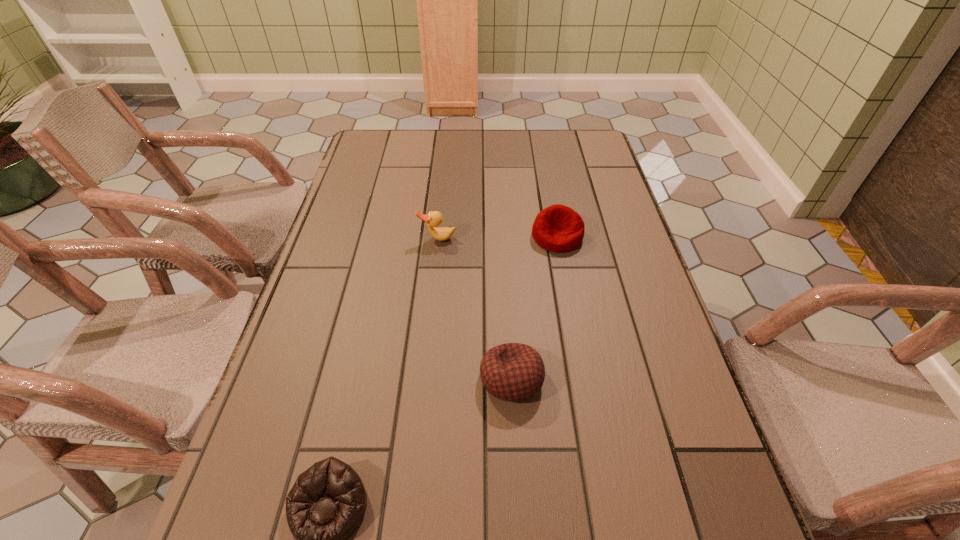
What are the coordinates of `the second object from left to right` in the screenshot? It's located at (435, 218).

Image resolution: width=960 pixels, height=540 pixels. Identify the location of the farthest beanbag. (558, 228).

The width and height of the screenshot is (960, 540). Find the location of `the rightmost object`. the rightmost object is located at coordinates (558, 228).

You are a GUI agent. You are given a task and a screenshot of the screen. Output one action in this format:
    pyautogui.click(x=<x>, y=<y>)
    Task: Click on the second nearest beanbag
    
    Given the screenshot: What is the action you would take?
    pyautogui.click(x=513, y=372)

The image size is (960, 540). In order to click on the second beanbag from left to right in this screenshot , I will do `click(513, 372)`.

Where is `vacant region located 0.180m on the beak of the duck`? This screenshot has height=540, width=960. vacant region located 0.180m on the beak of the duck is located at coordinates (431, 296).

The height and width of the screenshot is (540, 960). What are the coordinates of `free space located 0.230m on the seat area of the rightmost object` in the screenshot? It's located at (574, 327).

The image size is (960, 540). I want to click on free spot located 0.160m on the front of the second beanbag from right to left, so click(518, 500).

Identify the location of object located at the right edge. This screenshot has height=540, width=960. (558, 228).

In the image, there is a desktop. Where is `free region at the far edge`? free region at the far edge is located at coordinates (426, 148).